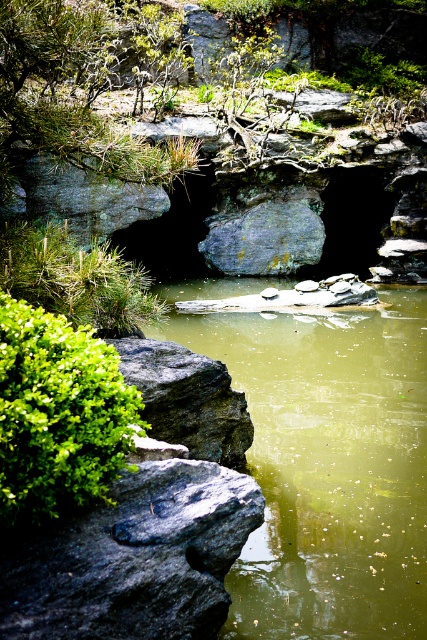
Question: Which is farther from the gray rough rock at center?

Choices:
 (A) gray rough rock at upper left
 (B) black rough rock at lower left
 (C) green leafy bush at lower left
 (D) green matte pine tree at left

Answer: (C)

Question: Is black rough rock at lower left positioned in front of gray rough rock at upper left?

Choices:
 (A) no
 (B) yes

Answer: (B)

Question: Does black rough rock at lower left appear over green leafy bush at lower left?

Choices:
 (A) no
 (B) yes

Answer: (A)

Question: Which of the following is the farthest from the observer?

Choices:
 (A) green matte pine tree at left
 (B) dark gray rock at center

Answer: (B)

Question: Can you confirm if green leafy bush at lower left is positioned to the right of gray rough rock at upper left?

Choices:
 (A) yes
 (B) no

Answer: (A)

Question: Based on their relative distances, which object is farther from the gray rough rock at center?

Choices:
 (A) green matte pine tree at left
 (B) dark gray rock at center

Answer: (A)